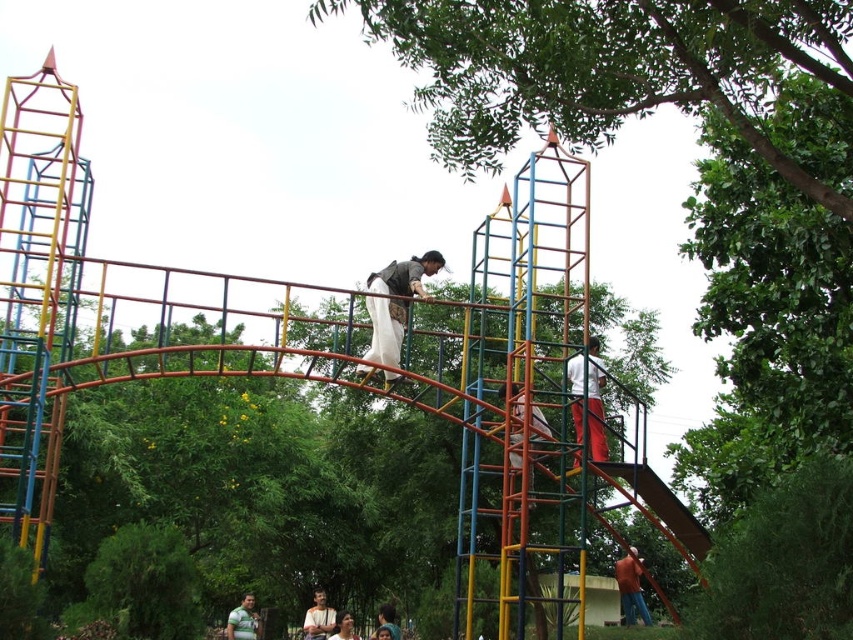
You are standing at the center of the playground and see the orange cotton shirt at lower right. Can you determine if the shirt is positioned to your left or right side?

The orange cotton shirt at lower right is located at point 0.919 on the x and y coordinates, which places it to your right side from your central position.

Consider the image. You are a photographer positioned at the front of the playground. You want to take a photo that includes both the matte brown vest at center and the green textured shirt at lower center. Which of the two should you focus on first to ensure both are in clear view?

The matte brown vest at center is closer to the viewer than the green textured shirt at lower center, so you should focus on the matte brown vest at center first to ensure both are in clear view.